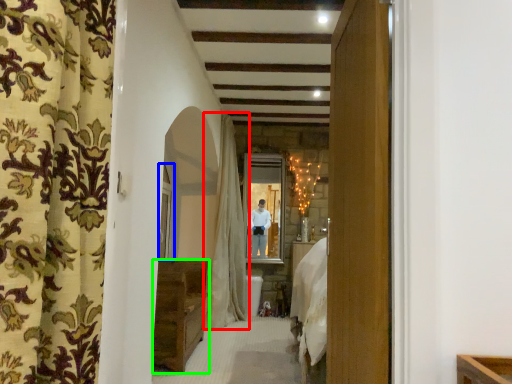
Question: Which object is positioned closest to curtain (highlighted by a red box)? Select from window (highlighted by a blue box) and furniture (highlighted by a green box).

Choices:
 (A) window
 (B) furniture

Answer: (A)